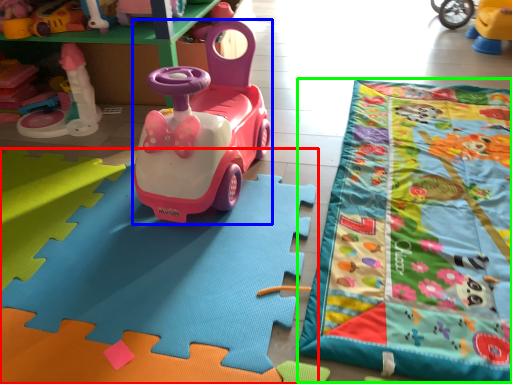
Question: Which is farther away from toy (highlighted by a red box)? toy car (highlighted by a blue box) or blanket (highlighted by a green box)?

Choices:
 (A) toy car
 (B) blanket

Answer: (B)